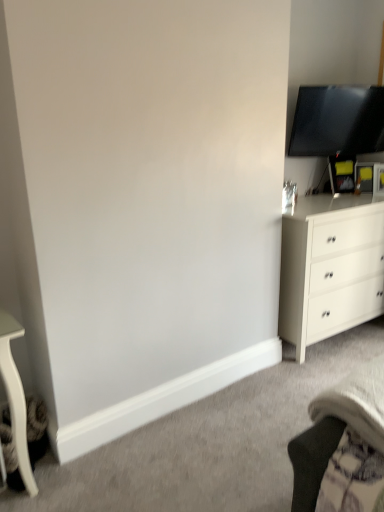
Question: Based on their sizes in the image, would you say white matte chest of drawers at right is bigger or smaller than matte black tv at upper right?

Choices:
 (A) small
 (B) big

Answer: (B)

Question: From a real-world perspective, is white matte chest of drawers at right positioned above or below matte black tv at upper right?

Choices:
 (A) above
 (B) below

Answer: (B)

Question: Is white matte chest of drawers at right spatially inside matte black tv at upper right, or outside of it?

Choices:
 (A) inside
 (B) outside

Answer: (B)

Question: From a real-world perspective, is matte black tv at upper right physically located above or below white matte chest of drawers at right?

Choices:
 (A) above
 (B) below

Answer: (A)

Question: From the image's perspective, relative to white matte chest of drawers at right, is matte black tv at upper right above or below?

Choices:
 (A) above
 (B) below

Answer: (A)

Question: Is point (311, 124) closer or farther from the camera than point (289, 325)?

Choices:
 (A) farther
 (B) closer

Answer: (A)

Question: Considering the positions of matte black tv at upper right and white matte chest of drawers at right in the image, is matte black tv at upper right taller or shorter than white matte chest of drawers at right?

Choices:
 (A) tall
 (B) short

Answer: (B)